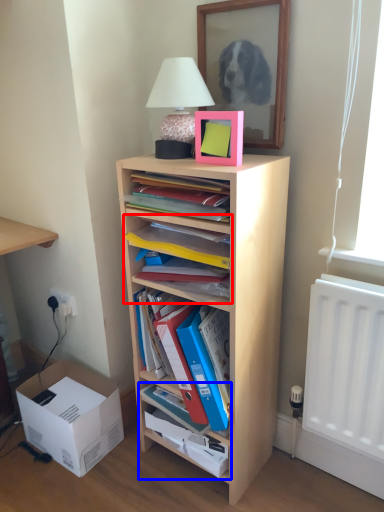
Question: Which point is further to the camera, shelf (highlighted by a red box) or cabinet (highlighted by a blue box)?

Choices:
 (A) shelf
 (B) cabinet

Answer: (B)